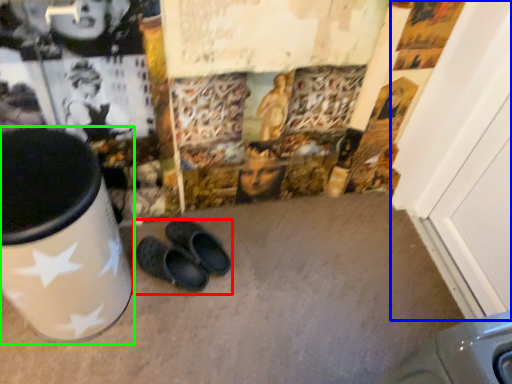
Question: Which is nearer to the footwear (highlighted by a red box)? door (highlighted by a blue box) or waste container (highlighted by a green box).

Choices:
 (A) door
 (B) waste container

Answer: (B)